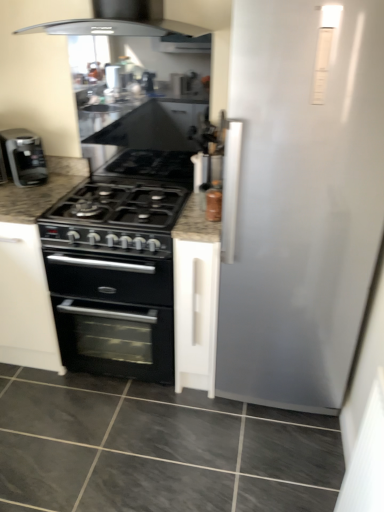
What do you see at coordinates (206, 169) in the screenshot?
I see `metallic silver spice jar at upper right` at bounding box center [206, 169].

Identify the location of gray marble floor at lower center. The height and width of the screenshot is (512, 384). (156, 449).

I want to click on black matte coffee machine at left, so click(24, 157).

Where is `metallic silver spice jar at upper right`? metallic silver spice jar at upper right is located at coordinates (206, 169).

Is black granite countertop at center next to gray marble floor at lower center and touching it?

No, black granite countertop at center is not touching gray marble floor at lower center.

Which point is more forward, (102, 337) or (1, 507)?

The point (1, 507) is closer.

Between metallic silver spice jar at upper right and black matte coffee machine at left, which one has larger width?

black matte coffee machine at left.

In terms of height, does metallic silver spice jar at upper right look taller or shorter compared to black matte coffee machine at left?

Clearly, metallic silver spice jar at upper right is taller compared to black matte coffee machine at left.

Can you tell me how much metallic silver spice jar at upper right and black matte coffee machine at left differ in facing direction?

The angle between the facing direction of metallic silver spice jar at upper right and the facing direction of black matte coffee machine at left is 46.3 degrees.

Is black granite countertop at center looking in the opposite direction of granite black stove at center?

No, granite black stove at center is not at the back of black granite countertop at center.

Which object is positioned more to the left, black granite countertop at center or granite black stove at center?

black granite countertop at center.

Which is nearer, [74,324] or [62,172]?

Point [74,324].

Can you confirm if black granite countertop at center is shorter than granite black stove at center?

No.

What's the angular difference between black matte coffee machine at left and granite black stove at center's facing directions?

The angle between the facing direction of black matte coffee machine at left and the facing direction of granite black stove at center is 42.5 degrees.

Does black matte coffee machine at left turn towards granite black stove at center?

No, black matte coffee machine at left is not turned towards granite black stove at center.

I want to click on kitchen appliance that appears on the left of granite black stove at center, so click(24, 157).

Is black matte coffee machine at left spatially inside granite black stove at center, or outside of it?

black matte coffee machine at left cannot be found inside granite black stove at center.

Is metallic silver spice jar at upper right to the right of gray marble floor at lower center from the viewer's perspective?

Yes, metallic silver spice jar at upper right is to the right of gray marble floor at lower center.

Is metallic silver spice jar at upper right turned away from gray marble floor at lower center?

metallic silver spice jar at upper right is not turned away from gray marble floor at lower center.

From the image's perspective, is granite black stove at center beneath gray marble floor at lower center?

No, from the image's perspective, granite black stove at center is not below gray marble floor at lower center.

Is gray marble floor at lower center completely or partially inside granite black stove at center?

No, gray marble floor at lower center is not surrounded by granite black stove at center.

Is granite black stove at center at the right side of gray marble floor at lower center?

Incorrect, granite black stove at center is not on the right side of gray marble floor at lower center.

Is granite black stove at center placed right next to gray marble floor at lower center?

granite black stove at center is not next to gray marble floor at lower center, and they're not touching.

Is granite black stove at center oriented towards black matte coffee machine at left?

No, granite black stove at center is not turned towards black matte coffee machine at left.

Is there a large distance between granite black stove at center and black matte coffee machine at left?

granite black stove at center is actually quite close to black matte coffee machine at left.

Considering the relative positions of granite black stove at center and black matte coffee machine at left in the image provided, is granite black stove at center to the left or to the right of black matte coffee machine at left?

granite black stove at center is positioned on black matte coffee machine at left's right side.

From a real-world perspective, is granite black stove at center located higher than black matte coffee machine at left?

No, from a real-world perspective, granite black stove at center is not above black matte coffee machine at left.

Find the location of a particular element. This screenshot has height=512, width=384. counter that appears above the gray marble floor at lower center (from a real-world perspective) is located at coordinates (113, 279).

Find the location of a particular element. The width and height of the screenshot is (384, 512). appliance in front of the black matte coffee machine at left is located at coordinates (206, 169).

Based on their spatial positions, is granite black stove at center or black matte coffee machine at left closer to gray marble floor at lower center?

Among the two, granite black stove at center is located nearer to gray marble floor at lower center.

Looking at this image, when comparing their distances from black granite countertop at center, does black matte coffee machine at left or gray marble floor at lower center seem further?

The object further to black granite countertop at center is black matte coffee machine at left.

Considering their positions, is black matte coffee machine at left positioned further to metallic silver spice jar at upper right than black granite countertop at center?

black matte coffee machine at left.

Based on their spatial positions, is gray marble floor at lower center or metallic silver spice jar at upper right further from black granite countertop at center?

metallic silver spice jar at upper right lies further to black granite countertop at center than the other object.

Which object lies nearer to the anchor point black granite countertop at center, granite black stove at center or metallic silver spice jar at upper right?

Among the two, granite black stove at center is located nearer to black granite countertop at center.

From the image, which object appears to be nearer to metallic silver spice jar at upper right, gray marble floor at lower center or black granite countertop at center?

black granite countertop at center lies closer to metallic silver spice jar at upper right than the other object.

Considering their positions, is gray marble floor at lower center positioned closer to black matte coffee machine at left than black granite countertop at center?

The object closer to black matte coffee machine at left is black granite countertop at center.

Based on their spatial positions, is black granite countertop at center or gray marble floor at lower center further from granite black stove at center?

gray marble floor at lower center is further to granite black stove at center.

Identify the location of countertop between metallic silver spice jar at upper right and black granite countertop at center from top to bottom. (41, 190).

Identify the location of countertop between black matte coffee machine at left and metallic silver spice jar at upper right in the horizontal direction. (41, 190).

Locate an element on the screen. counter between black matte coffee machine at left and metallic silver spice jar at upper right is located at coordinates (113, 279).

Where is `countertop between metallic silver spice jar at upper right and gray marble floor at lower center in the up-down direction`? countertop between metallic silver spice jar at upper right and gray marble floor at lower center in the up-down direction is located at coordinates (41, 190).